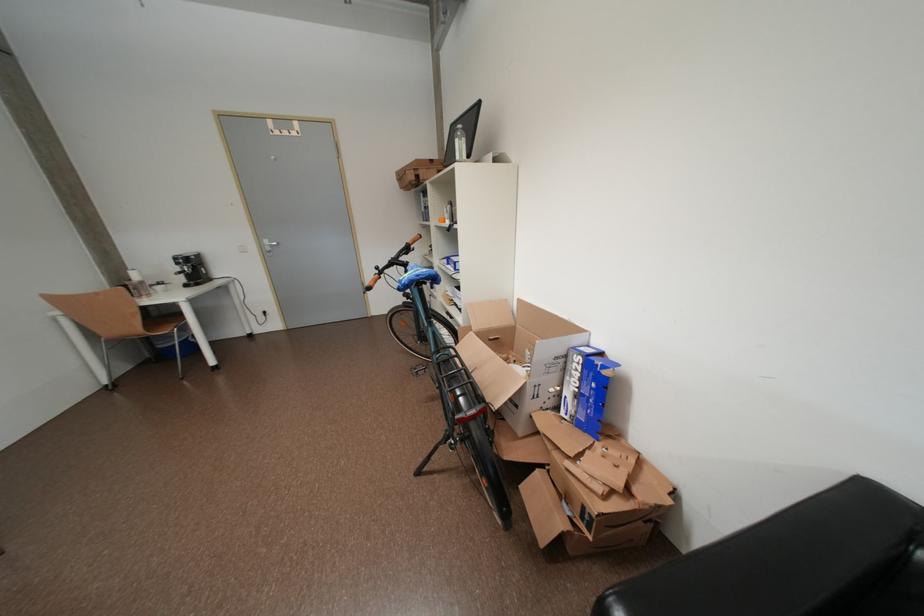
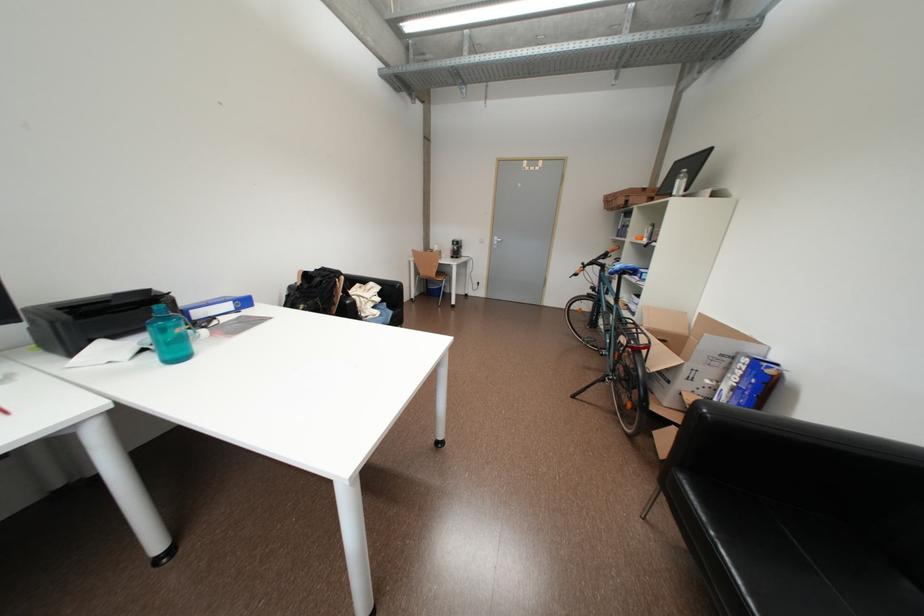
Locate, in the second image, the point that corresponds to [565,360] in the first image.

(731, 358)